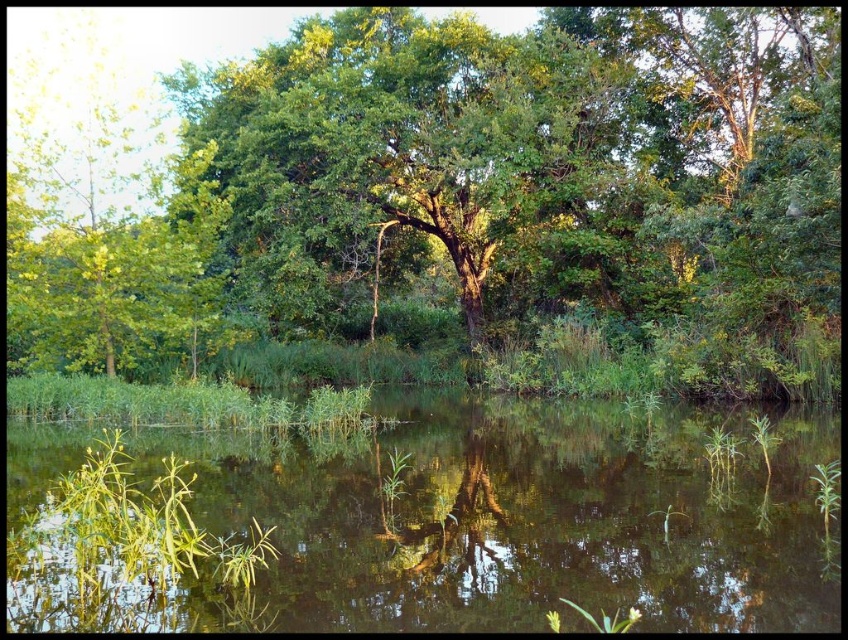
Question: Is green leafy tree at center above green grassy lake at center?

Choices:
 (A) yes
 (B) no

Answer: (A)

Question: Estimate the real-world distances between objects in this image. Which object is farther from the green grassy lake at center?

Choices:
 (A) green leafy tree at center
 (B) green matte tree at center

Answer: (A)

Question: Which point is closer to the camera taking this photo?

Choices:
 (A) (187, 86)
 (B) (388, 540)
 (C) (336, 552)

Answer: (C)

Question: Which object is closer to the camera taking this photo?

Choices:
 (A) green matte tree at center
 (B) green leafy tree at center
 (C) green grassy lake at center

Answer: (C)

Question: Is green grassy lake at center closer to the viewer compared to green matte tree at center?

Choices:
 (A) no
 (B) yes

Answer: (B)

Question: Is green leafy tree at center positioned at the back of green grassy lake at center?

Choices:
 (A) yes
 (B) no

Answer: (A)